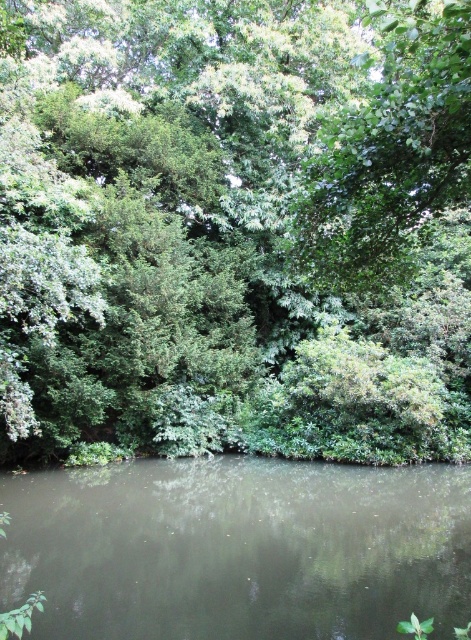
You are standing at the edge of the water in the scene and want to determine which object is taller between the green leafy tree at center and the green leafy water at center. Which one is taller?

The green leafy tree at center is taller than the green leafy water at center according to the description.

You are standing at the edge of the water in this serene natural scene. There are two points marked in the image. The first point is at coordinates point (329, 90) and the second point is at point (113, 492). Which of these two points is closer to you?

Point (329, 90) is further to the viewer than point (113, 492), so the point closer to you is point (113, 492).